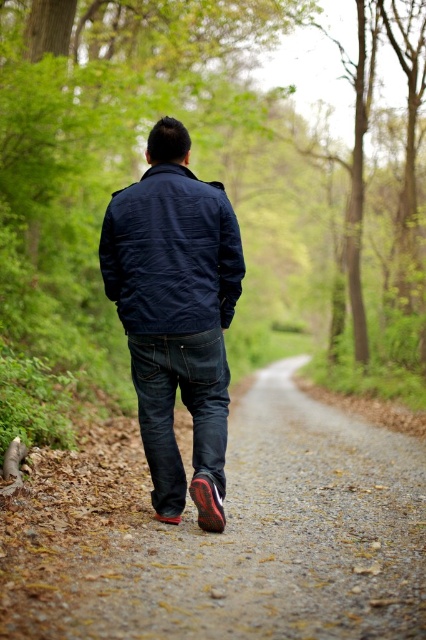
Question: Is navy blue jacket at center to the left of dark blue denim jeans at center from the viewer's perspective?

Choices:
 (A) yes
 (B) no

Answer: (A)

Question: Does navy blue jacket at center have a larger size compared to navy fabric jacket at center?

Choices:
 (A) yes
 (B) no

Answer: (A)

Question: Which point is farther from the camera taking this photo?

Choices:
 (A) (233, 227)
 (B) (112, 236)
 (C) (317, 156)

Answer: (C)

Question: Which of the following is the closest to the observer?

Choices:
 (A) (215, 252)
 (B) (115, 20)

Answer: (A)

Question: Does green matte forest at center appear on the left side of dirt/gravel path at center?

Choices:
 (A) no
 (B) yes

Answer: (B)

Question: Among these points, which one is farthest from the camera?

Choices:
 (A) (221, 417)
 (B) (176, 264)
 (C) (316, 310)
 (D) (112, 621)

Answer: (C)